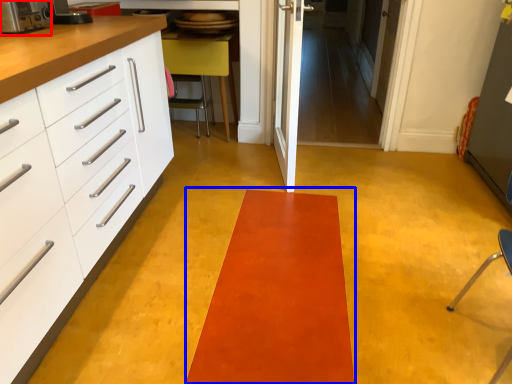
Question: Which point is closer to the camera, appliance (highlighted by a red box) or mat (highlighted by a blue box)?

Choices:
 (A) appliance
 (B) mat

Answer: (B)